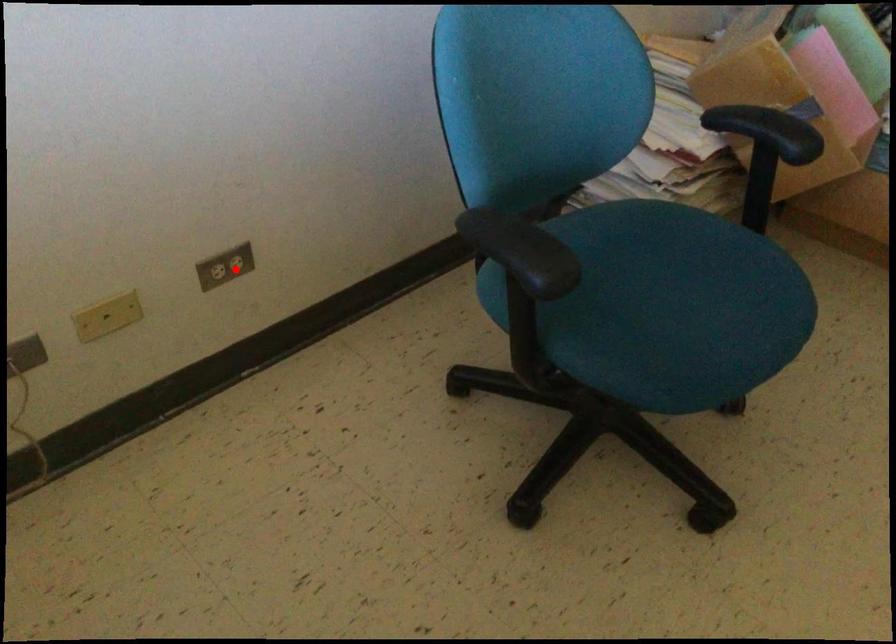
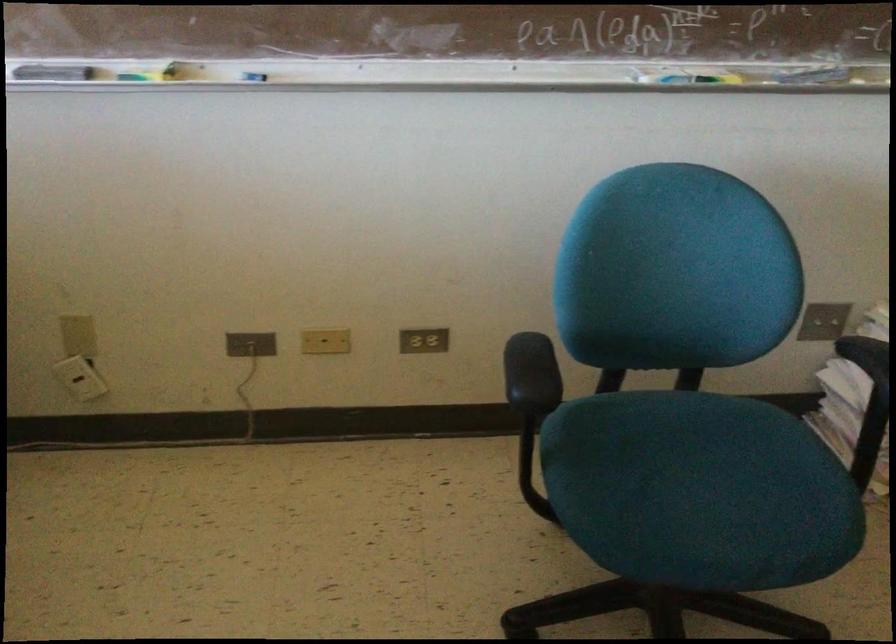
The point at the highlighted location is marked in the first image. Where is the corresponding point in the second image?

(423, 341)